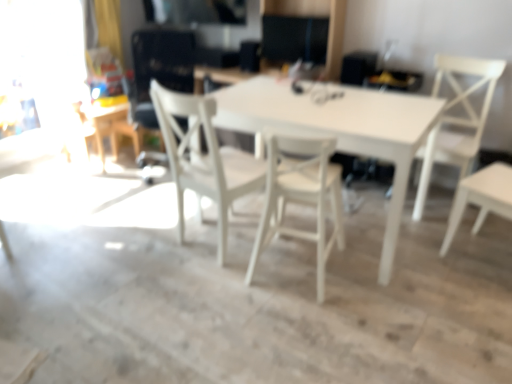
Find the location of `vacant space in front of white wood chair at center, which ranks as the 1th chair in left-to-right order`. vacant space in front of white wood chair at center, which ranks as the 1th chair in left-to-right order is located at coordinates (202, 289).